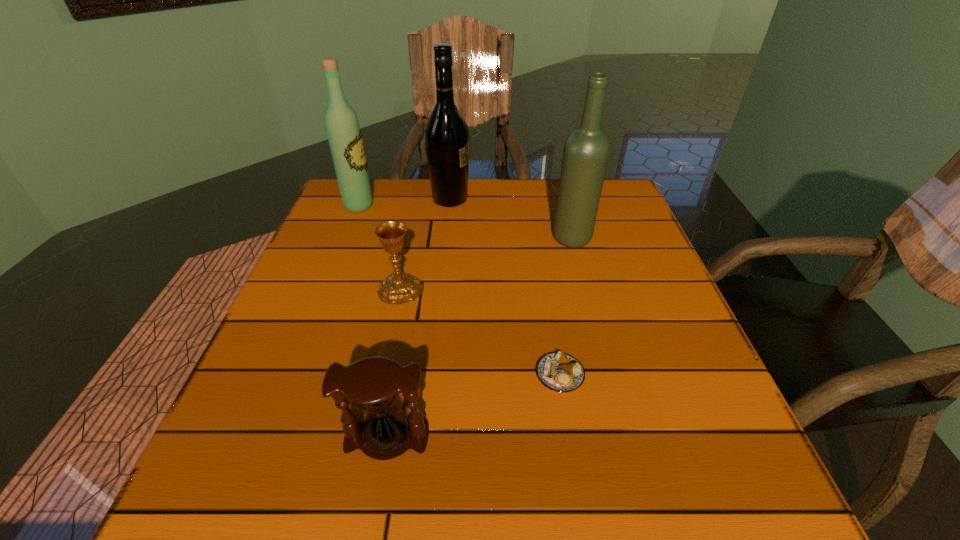
Find the location of a particular element. This screenshot has width=960, height=540. vacant space located 0.210m on the front-facing side of the leftmost object is located at coordinates (451, 205).

This screenshot has height=540, width=960. Identify the location of vacant space situated on the back of the nearest object. (412, 294).

Where is `vacant space located on the right of the chalice`? This screenshot has height=540, width=960. vacant space located on the right of the chalice is located at coordinates (540, 289).

The height and width of the screenshot is (540, 960). I want to click on vacant position located on the back of the fifth farthest object, so click(538, 240).

Identify the location of object present at the left edge. (342, 126).

Where is `object that is at the right edge`? object that is at the right edge is located at coordinates (586, 151).

Where is `object that is at the far left corner`? object that is at the far left corner is located at coordinates (342, 126).

Locate an element on the screen. The height and width of the screenshot is (540, 960). vacant region at the far edge is located at coordinates (487, 192).

What are the coordinates of `vacant space at the near edge` in the screenshot? It's located at point(590,482).

The width and height of the screenshot is (960, 540). I want to click on free region at the left edge of the desktop, so click(324, 310).